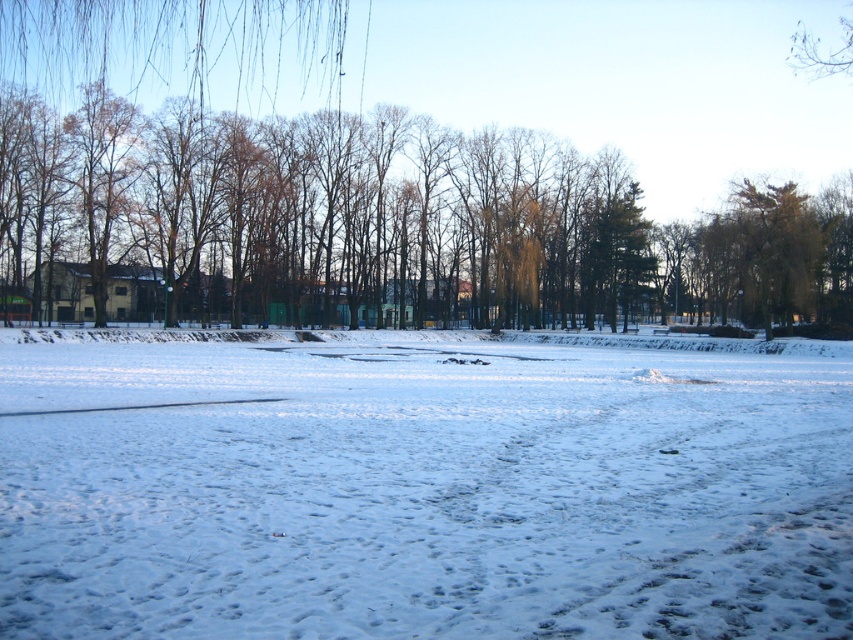
You are standing at the edge of the frozen lake in the winter scene. You see a point marked at coordinates (421, 488). What is located at that point?

The point at coordinates (421, 488) corresponds to white powdery snow at center.

You are standing at the brown leafless tree at left and want to walk to the white powdery snow at center. How many steps would you need to take if each step covers 3 feet?

The distance between the brown leafless tree at left and the white powdery snow at center is 72.77 feet. Since each step covers 3 feet, you would need approximately 24 steps to reach the white powdery snow at center.

You are planning to build a snowman using the white powdery snow at center and the brown leafless tree at left. Which object can provide more material for the snowman?

The brown leafless tree at left can provide more material for the snowman because the white powdery snow at center has a lesser width compared to the brown leafless tree at left.